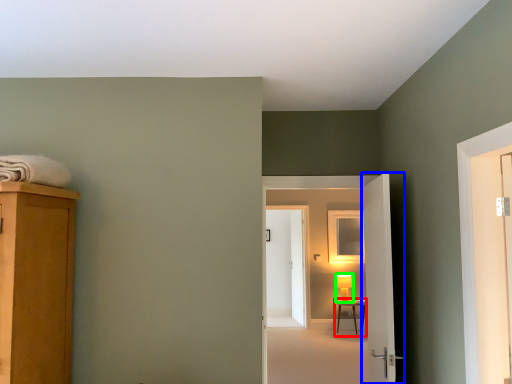
Question: Considering the real-world distances, which object is farthest from table (highlighted by a red box)? door (highlighted by a blue box) or table lamp (highlighted by a green box)?

Choices:
 (A) door
 (B) table lamp

Answer: (A)